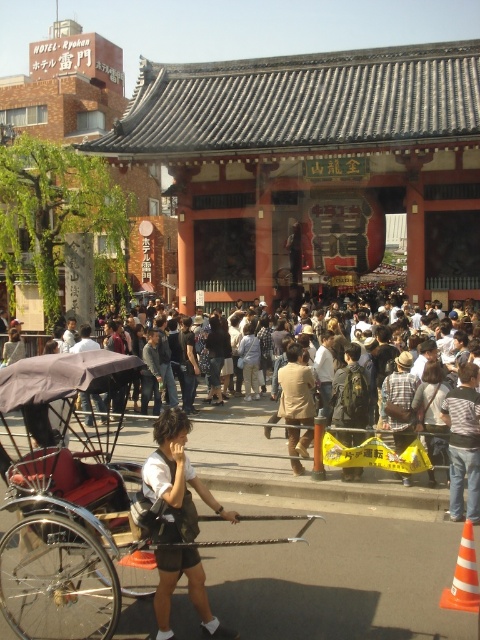
You are a tourist standing in front of the temple gate. You see the wooden cart at center and the white fabric shirt at center. Which object is nearer to you?

The wooden cart at center is closer to the viewer than the white fabric shirt at center.